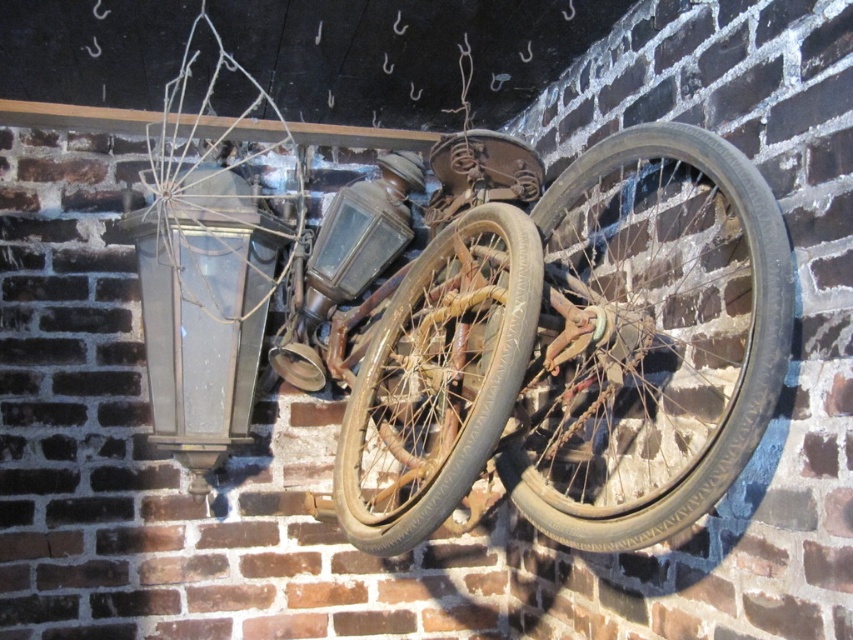
You are standing in front of the vintage bicycle displayed against the brick wall. There are two points marked on the bicycle, one at coordinates point (618, 312) and another at point (407, 355). Which of these two points is nearer to you?

Point (618, 312) is closer to the viewer than point (407, 355).

You are an art curator examining the vintage bicycle display. You notice two rusty metal wheels at the center of the image. Which wheel is closer to you, the rusty metal bicycle wheel at center or the rusty metal wheel at center?

The rusty metal bicycle wheel at center is closer to you because it is in front of the rusty metal wheel at center.

How far apart are the rusty metal bicycle wheel at center and the rusty metal wheel at center?

The distance between the rusty metal bicycle wheel at center and the rusty metal wheel at center is 8.55 inches.